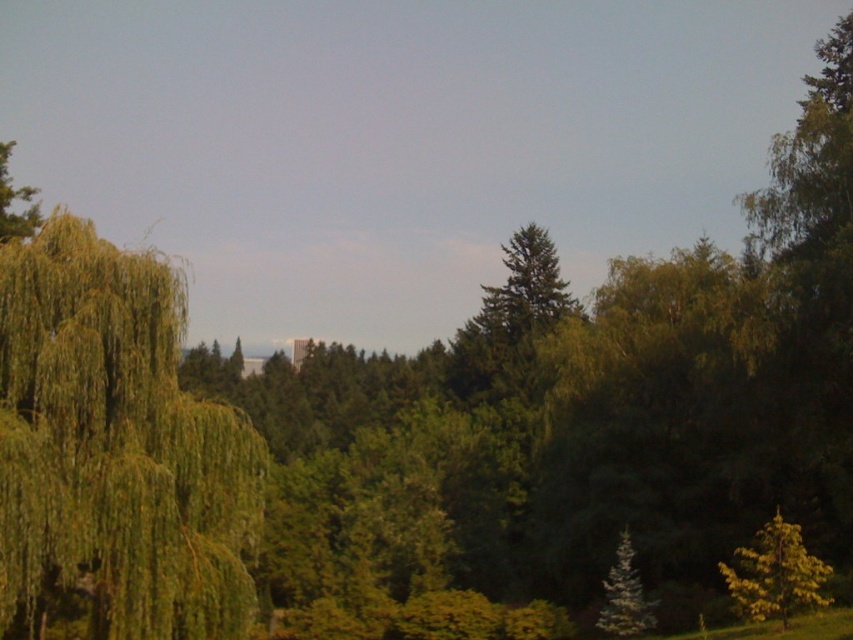
You are standing in the lush green landscape and want to find the green leafy willow at left. Based on its coordinates, which direction should you look to locate it?

The green leafy willow at left is located at point [117,445], which corresponds to the left side of the image. Therefore, you should look to your left to locate it.